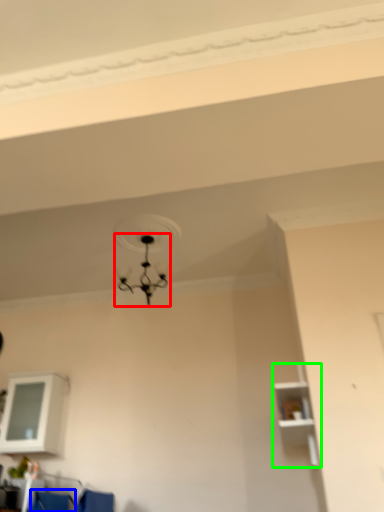
Question: Based on their relative distances, which object is nearer to lamp (highlighted by a red box)? Choose from armchair (highlighted by a blue box) and shelf (highlighted by a green box).

Choices:
 (A) armchair
 (B) shelf

Answer: (B)